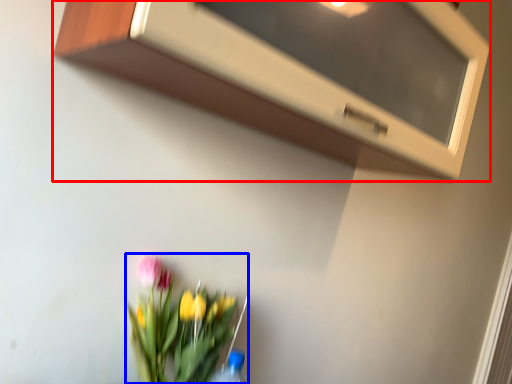
Question: Which of the following is the closest to the observer, microwave (highlighted by a red box) or floral arrangement (highlighted by a blue box)?

Choices:
 (A) microwave
 (B) floral arrangement

Answer: (A)